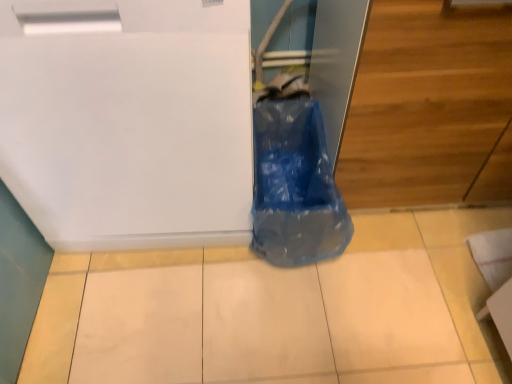
This screenshot has width=512, height=384. Find the location of `blue plastic bag at center`. blue plastic bag at center is located at coordinates (295, 187).

What do you see at coordinates (295, 187) in the screenshot? I see `blue plastic bag at center` at bounding box center [295, 187].

Identify the location of blue plastic bag at center. The height and width of the screenshot is (384, 512). (295, 187).